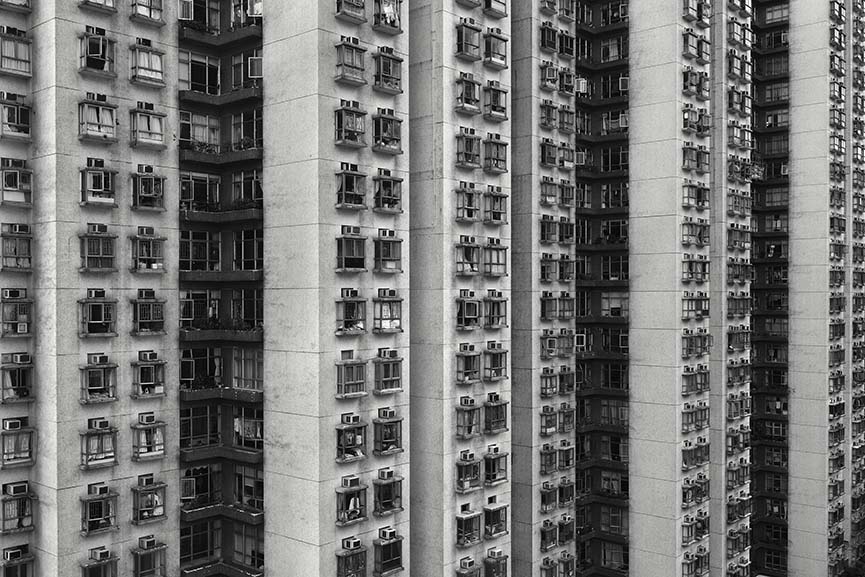
Locate an element on the screen. The image size is (865, 577). air conditioning unit located farthest top left in photo is located at coordinates pos(11,33).